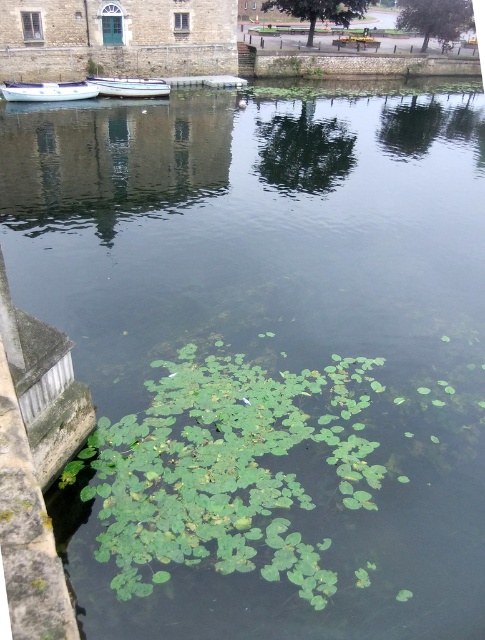
What do you see at coordinates (48, 92) in the screenshot?
I see `white plastic boat at left` at bounding box center [48, 92].

Locate an element on the screen. Image resolution: width=485 pixels, height=640 pixels. white plastic boat at left is located at coordinates (48, 92).